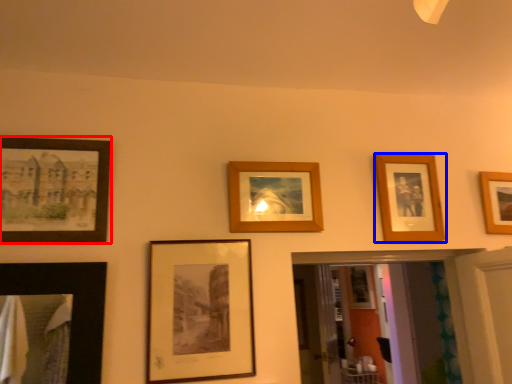
Question: Which of the following is the farthest to the observer, picture frame (highlighted by a red box) or picture frame (highlighted by a blue box)?

Choices:
 (A) picture frame
 (B) picture frame

Answer: (B)